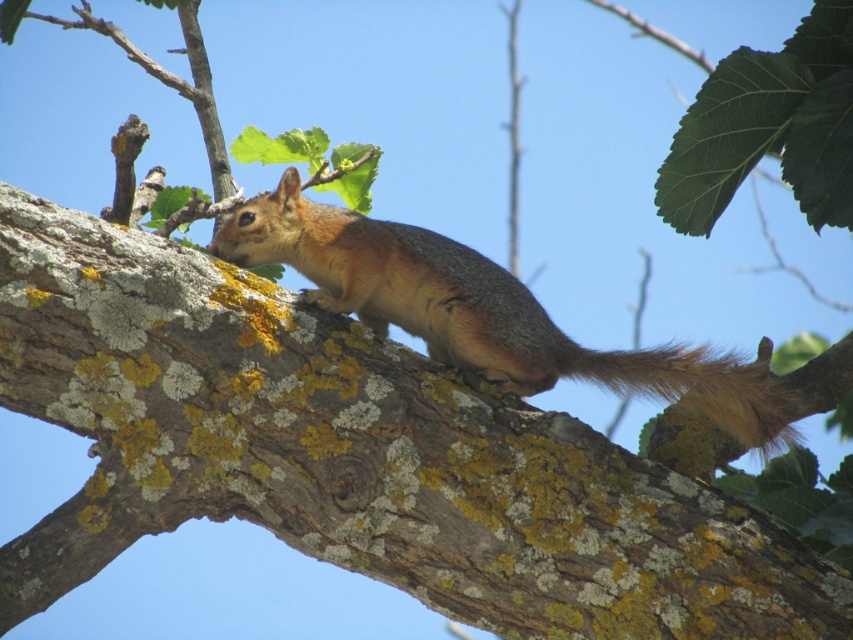
I want to click on golden fur squirrel at center, so click(483, 312).

Is golden fur squirrel at center bigger than brown furry tail at right?

Yes.

In the scene shown: Who is more distant from viewer, (751,432) or (764,436)?

The point (751,432) is behind.

Where is `golden fur squirrel at center`? Image resolution: width=853 pixels, height=640 pixels. golden fur squirrel at center is located at coordinates (483, 312).